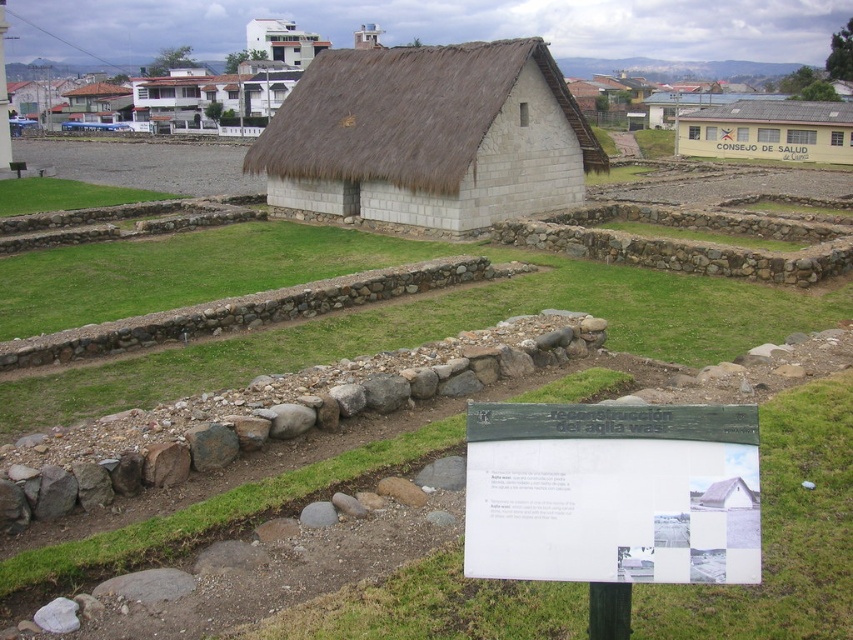
Is green grass at upper left wider than yellow paper sign at center?

Indeed, green grass at upper left has a greater width compared to yellow paper sign at center.

Does green grass at upper left have a lesser width compared to yellow paper sign at center?

No, green grass at upper left is not thinner than yellow paper sign at center.

Image resolution: width=853 pixels, height=640 pixels. Describe the element at coordinates (65, 195) in the screenshot. I see `green grass at upper left` at that location.

The height and width of the screenshot is (640, 853). What are the coordinates of `green grass at upper left` in the screenshot? It's located at (65, 195).

Who is taller, thatched straw roof at center or green grass at center?

thatched straw roof at center is taller.

Is thatched straw roof at center behind green grass at center?

That is True.

This screenshot has height=640, width=853. Describe the element at coordinates (428, 136) in the screenshot. I see `thatched straw roof at center` at that location.

Find the location of a particular element. This screenshot has height=640, width=853. thatched straw roof at center is located at coordinates (428, 136).

Who is positioned more to the right, white paper sign at center or green grass at center?

From the viewer's perspective, green grass at center appears more on the right side.

The width and height of the screenshot is (853, 640). What are the coordinates of `white paper sign at center` in the screenshot? It's located at (612, 492).